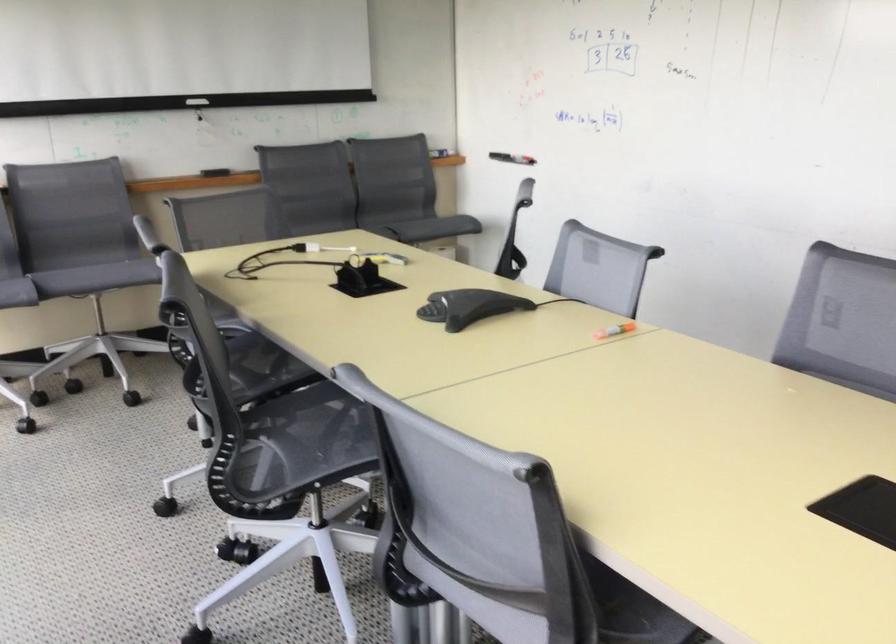
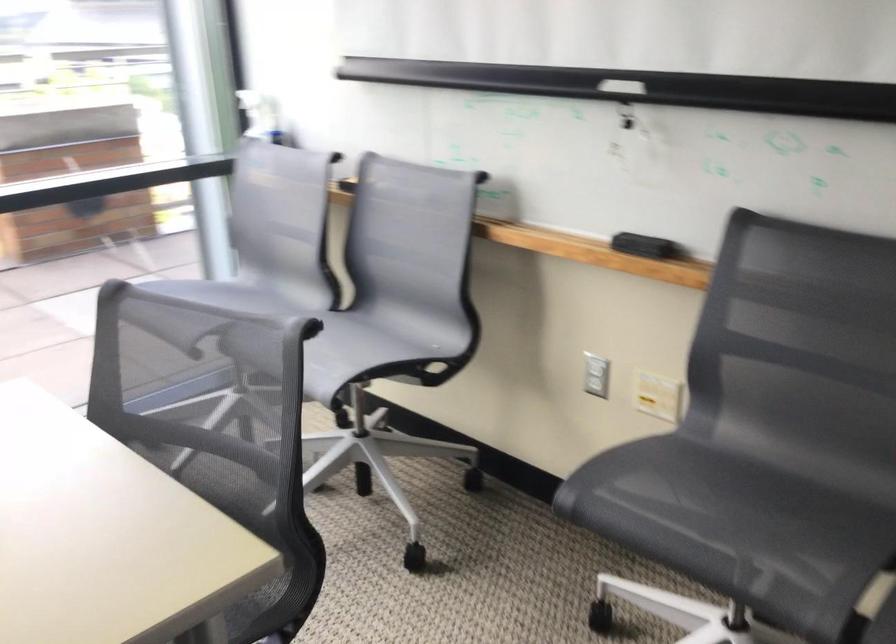
Locate, in the second image, the point that corresponds to point 109,263 in the first image.

(348, 351)